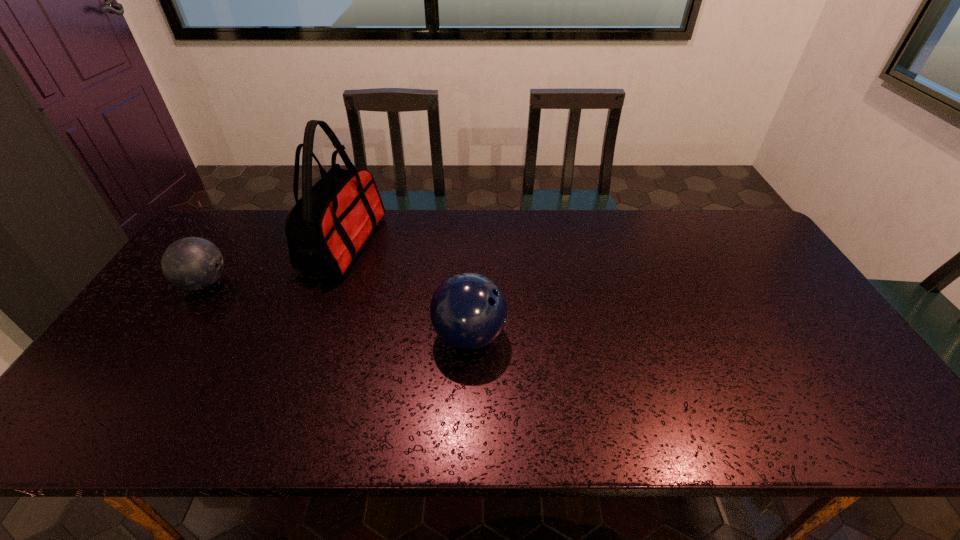
Locate an element on the screen. The height and width of the screenshot is (540, 960). the second object from right to left is located at coordinates (325, 229).

The height and width of the screenshot is (540, 960). I want to click on duffel bag, so click(325, 229).

Where is `the right bowling ball`? the right bowling ball is located at coordinates (468, 311).

At what (x,y) coordinates should I click in order to perform the action: click on the rightmost object. Please return your answer as a coordinate pair (x, y). Image resolution: width=960 pixels, height=540 pixels. Looking at the image, I should click on (468, 311).

This screenshot has height=540, width=960. I want to click on the farther bowling ball, so click(x=192, y=263).

I want to click on the shorter bowling ball, so click(x=192, y=263).

The image size is (960, 540). In order to click on vacant space located 0.050m on the right of the second object from right to left in this screenshot , I will do `click(395, 244)`.

You are a GUI agent. You are given a task and a screenshot of the screen. Output one action in this format:
    pyautogui.click(x=<x>, y=<y>)
    Task: Click on the vacant space positioned 0.340m on the surface of the right bowling ball near the finger holes
    
    Given the screenshot: What is the action you would take?
    pyautogui.click(x=636, y=336)

Where is `vacant space located 0.200m on the grip area of the farther bowling ball`? vacant space located 0.200m on the grip area of the farther bowling ball is located at coordinates (299, 283).

You are a GUI agent. You are given a task and a screenshot of the screen. Output one action in this format:
    pyautogui.click(x=<x>, y=<y>)
    Task: Click on the object present at the far edge
    
    Given the screenshot: What is the action you would take?
    click(x=325, y=229)